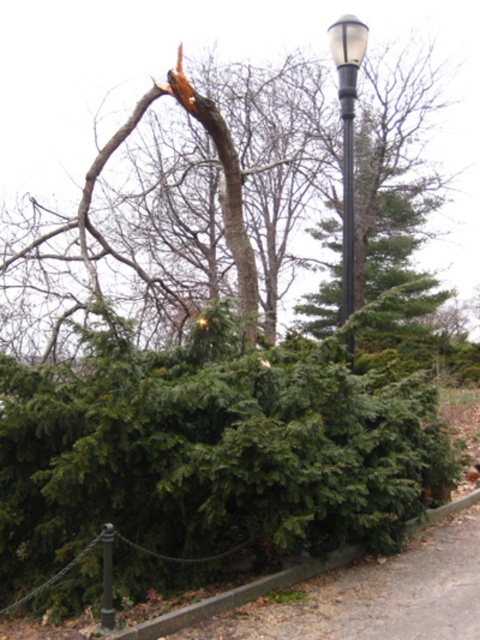
Question: Considering the real-world distances, which object is closest to the matte black streetlight at upper right?

Choices:
 (A) brown rough bark tree at upper center
 (B) green leafy hedge at lower center

Answer: (B)

Question: Does green leafy hedge at lower center come in front of brown rough bark tree at upper center?

Choices:
 (A) yes
 (B) no

Answer: (A)

Question: Among these objects, which one is nearest to the camera?

Choices:
 (A) matte black streetlight at upper right
 (B) metallic gray pole at center
 (C) green leafy hedge at lower center
 (D) brown rough bark tree at upper center

Answer: (C)

Question: Is green leafy hedge at lower center bigger than metallic gray pole at center?

Choices:
 (A) no
 (B) yes

Answer: (B)

Question: From the image, what is the correct spatial relationship of green leafy hedge at lower center in relation to brown rough bark tree at upper center?

Choices:
 (A) below
 (B) above

Answer: (A)

Question: Which object appears farthest from the camera in this image?

Choices:
 (A) matte black streetlight at upper right
 (B) green leafy hedge at lower center

Answer: (A)